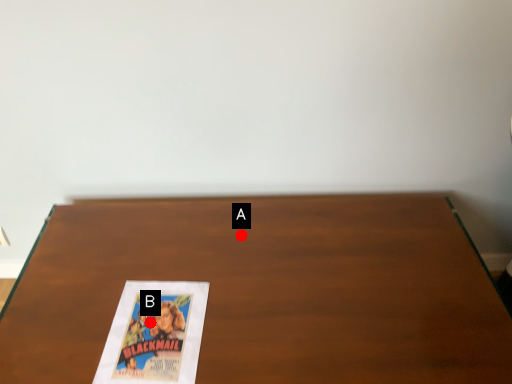
Question: Two points are circled on the image, labeled by A and B beside each circle. Among these points, which one is farthest from the camera?

Choices:
 (A) A is further
 (B) B is further

Answer: (A)